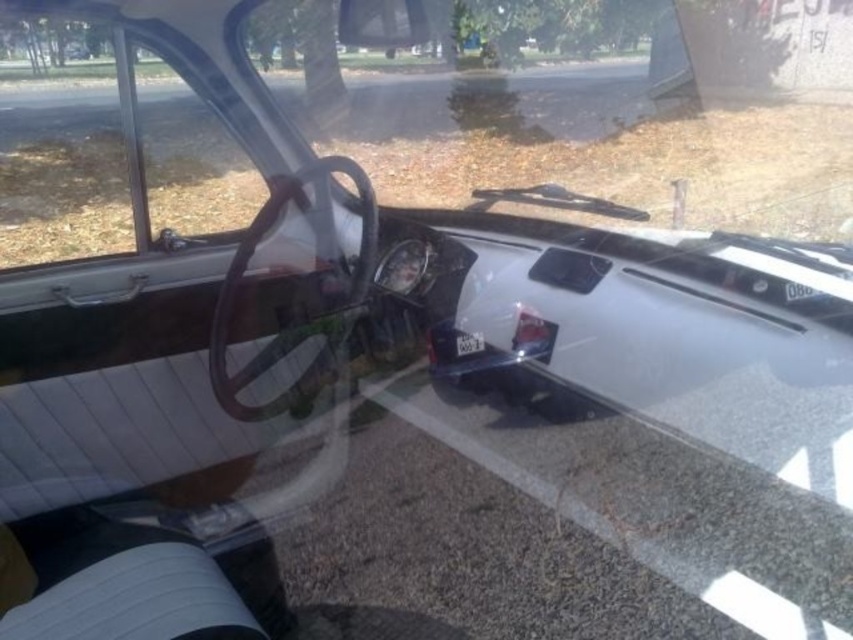
Question: Which point is closer to the camera?

Choices:
 (A) (397, 29)
 (B) (123, 220)

Answer: (A)

Question: Observing the image, what is the correct spatial positioning of transparent glass windshield at center in reference to clear glass window at left?

Choices:
 (A) left
 (B) right

Answer: (B)

Question: From the image, what is the correct spatial relationship of transparent glass windshield at center in relation to clear glass window at left?

Choices:
 (A) above
 (B) below

Answer: (A)

Question: Is transparent glass windshield at center smaller than clear glass window at left?

Choices:
 (A) no
 (B) yes

Answer: (A)

Question: Which point is closer to the camera?

Choices:
 (A) transparent glass windshield at center
 (B) clear glass window at left

Answer: (B)

Question: Which point is closer to the camera taking this photo?

Choices:
 (A) tap(701, 141)
 (B) tap(6, 44)

Answer: (A)